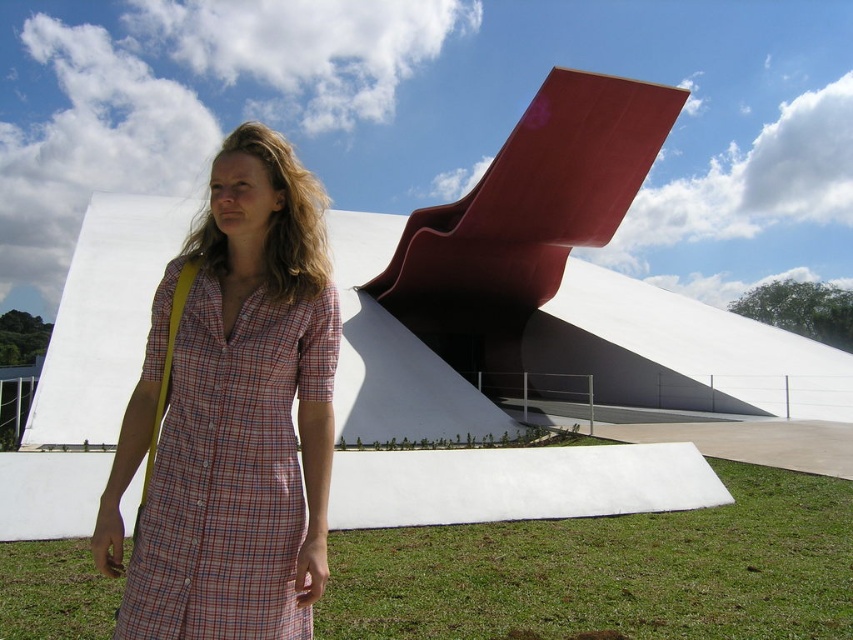
Question: Among these objects, which one is nearest to the camera?

Choices:
 (A) plaid cotton dress at center
 (B) green grass at lower center

Answer: (A)

Question: Is green grass at lower center in front of plaid cotton dress at center?

Choices:
 (A) yes
 (B) no

Answer: (B)

Question: Can you confirm if green grass at lower center is positioned to the left of plaid cotton dress at center?

Choices:
 (A) no
 (B) yes

Answer: (A)

Question: Is green grass at lower center above plaid cotton dress at center?

Choices:
 (A) yes
 (B) no

Answer: (B)